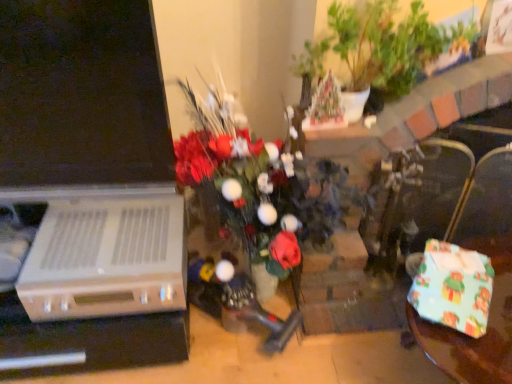
I want to click on green leafy plant at upper center, so click(374, 47).

From the image's perspective, which object appears higher, dark brown leather armchair at right or green leafy plant at upper center?

green leafy plant at upper center, from the image's perspective.

Between dark brown leather armchair at right and green leafy plant at upper center, which one has larger size?

green leafy plant at upper center.

Identify the location of armchair behind the green leafy plant at upper center. The image size is (512, 384). (415, 202).

Is dark brown leather armchair at right positioned in front of wrapping paper gift at lower right?

No, the depth of dark brown leather armchair at right is greater than that of wrapping paper gift at lower right.

How different are the orientations of dark brown leather armchair at right and wrapping paper gift at lower right in degrees?

33.9 degrees separate the facing orientations of dark brown leather armchair at right and wrapping paper gift at lower right.

Which of these two, dark brown leather armchair at right or wrapping paper gift at lower right, is bigger?

With larger size is dark brown leather armchair at right.

Does dark brown leather armchair at right have a lesser height compared to wrapping paper gift at lower right?

No.

Would you say green leafy plant at upper center is to the left or to the right of dark brown leather armchair at right in the picture?

green leafy plant at upper center is to the left of dark brown leather armchair at right.

Is green leafy plant at upper center looking in the opposite direction of dark brown leather armchair at right?

green leafy plant at upper center does not have its back to dark brown leather armchair at right.

Considering the relative sizes of green leafy plant at upper center and dark brown leather armchair at right in the image provided, is green leafy plant at upper center taller than dark brown leather armchair at right?

In fact, green leafy plant at upper center may be shorter than dark brown leather armchair at right.

Considering the sizes of green leafy plant at upper center and dark brown leather armchair at right in the image, is green leafy plant at upper center bigger or smaller than dark brown leather armchair at right?

Considering their sizes, green leafy plant at upper center takes up more space than dark brown leather armchair at right.

From a real-world perspective, is green leafy plant at upper center positioned over wrapping paper gift at lower right based on gravity?

Yes, from a real-world perspective, green leafy plant at upper center is over wrapping paper gift at lower right

How different are the orientations of green leafy plant at upper center and wrapping paper gift at lower right in degrees?

The facing directions of green leafy plant at upper center and wrapping paper gift at lower right are 33.9 degrees apart.

Which of these two, green leafy plant at upper center or wrapping paper gift at lower right, is thinner?

green leafy plant at upper center.

Is wrapping paper gift at lower right positioned beyond the bounds of dark brown leather armchair at right?

Absolutely, wrapping paper gift at lower right is external to dark brown leather armchair at right.

Is wrapping paper gift at lower right next to dark brown leather armchair at right?

No.

Is wrapping paper gift at lower right shorter than dark brown leather armchair at right?

Indeed, wrapping paper gift at lower right has a lesser height compared to dark brown leather armchair at right.

From the image's perspective, which object appears higher, wrapping paper gift at lower right or green leafy plant at upper center?

green leafy plant at upper center appears higher in the image.

Does wrapping paper gift at lower right have a greater width compared to green leafy plant at upper center?

Indeed, wrapping paper gift at lower right has a greater width compared to green leafy plant at upper center.

From a real-world perspective, which is physically below, wrapping paper gift at lower right or green leafy plant at upper center?

wrapping paper gift at lower right, from a real-world perspective.

Does wrapping paper gift at lower right have a larger size compared to green leafy plant at upper center?

Actually, wrapping paper gift at lower right might be smaller than green leafy plant at upper center.

Where is `houseplant that appears above the dark brown leather armchair at right (from a real-world perspective)`? The width and height of the screenshot is (512, 384). houseplant that appears above the dark brown leather armchair at right (from a real-world perspective) is located at coordinates (374, 47).

What are the coordinates of `table in front of the dark brown leather armchair at right` in the screenshot? It's located at (487, 326).

Based on their spatial positions, is green leafy plant at upper center or dark brown leather armchair at right further from wrapping paper gift at lower right?

Among the two, green leafy plant at upper center is located further to wrapping paper gift at lower right.

When comparing their distances from dark brown leather armchair at right, does green leafy plant at upper center or wrapping paper gift at lower right seem further?

green leafy plant at upper center lies further to dark brown leather armchair at right than the other object.

Considering their positions, is dark brown leather armchair at right positioned closer to green leafy plant at upper center than wrapping paper gift at lower right?

Based on the image, dark brown leather armchair at right appears to be nearer to green leafy plant at upper center.

Which object lies further to the anchor point wrapping paper gift at lower right, dark brown leather armchair at right or green leafy plant at upper center?

Based on the image, green leafy plant at upper center appears to be further to wrapping paper gift at lower right.

Which object lies further to the anchor point green leafy plant at upper center, wrapping paper gift at lower right or dark brown leather armchair at right?

Among the two, wrapping paper gift at lower right is located further to green leafy plant at upper center.

From the image, which object appears to be nearer to dark brown leather armchair at right, wrapping paper gift at lower right or green leafy plant at upper center?

wrapping paper gift at lower right lies closer to dark brown leather armchair at right than the other object.

At what (x,y) coordinates should I click in order to perform the action: click on armchair between green leafy plant at upper center and wrapping paper gift at lower right in the up-down direction. Please return your answer as a coordinate pair (x, y). This screenshot has height=384, width=512. Looking at the image, I should click on (415, 202).